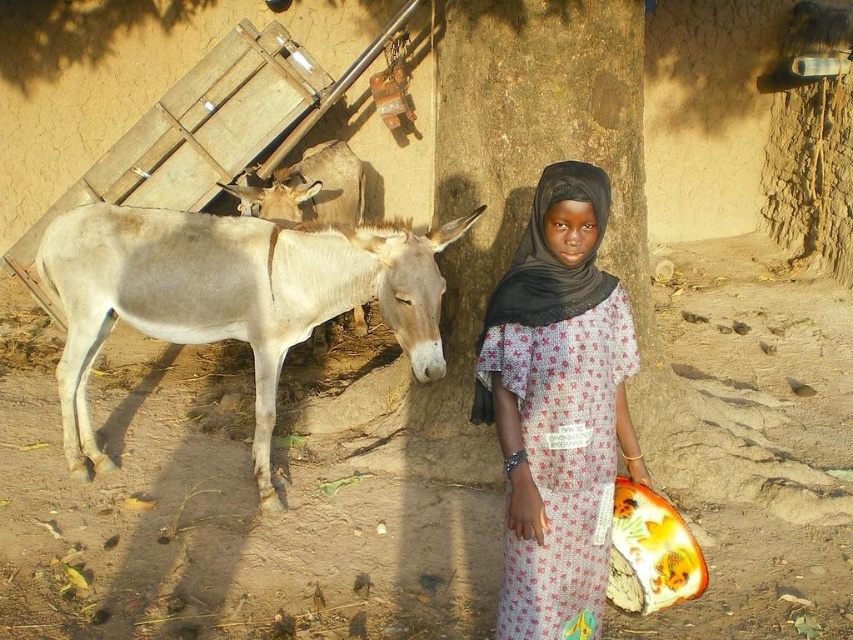
Measure the distance from brown dirt field at center to printed cotton dress at center.

brown dirt field at center and printed cotton dress at center are 4.78 feet apart.

I want to click on brown dirt field at center, so click(x=236, y=500).

Describe the element at coordinates (230, 298) in the screenshot. I see `light gray smooth mule at left` at that location.

Looking at this image, does light gray smooth mule at left appear over white matte mule at center?

No, light gray smooth mule at left is not above white matte mule at center.

Image resolution: width=853 pixels, height=640 pixels. What are the coordinates of `light gray smooth mule at left` in the screenshot? It's located at (230, 298).

What are the coordinates of `light gray smooth mule at left` in the screenshot? It's located at (230, 298).

Which is behind, point (218, 282) or point (583, 588)?

The point (218, 282) is behind.

Who is lower down, light gray smooth mule at left or printed cotton dress at center?

printed cotton dress at center

This screenshot has height=640, width=853. Describe the element at coordinates (230, 298) in the screenshot. I see `light gray smooth mule at left` at that location.

The height and width of the screenshot is (640, 853). Identify the location of light gray smooth mule at left. (230, 298).